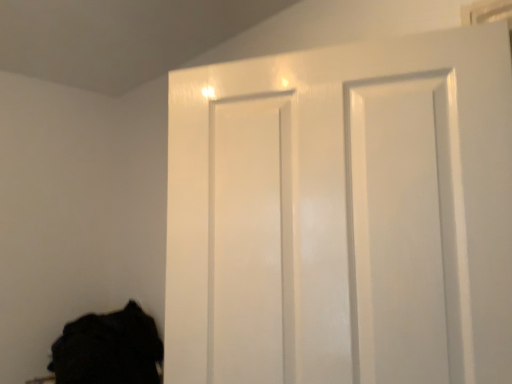
In order to click on white glossy door at center in this screenshot , I will do `click(343, 215)`.

Image resolution: width=512 pixels, height=384 pixels. Describe the element at coordinates (343, 215) in the screenshot. I see `white glossy door at center` at that location.

Where is `white glossy door at center`? The height and width of the screenshot is (384, 512). white glossy door at center is located at coordinates (343, 215).